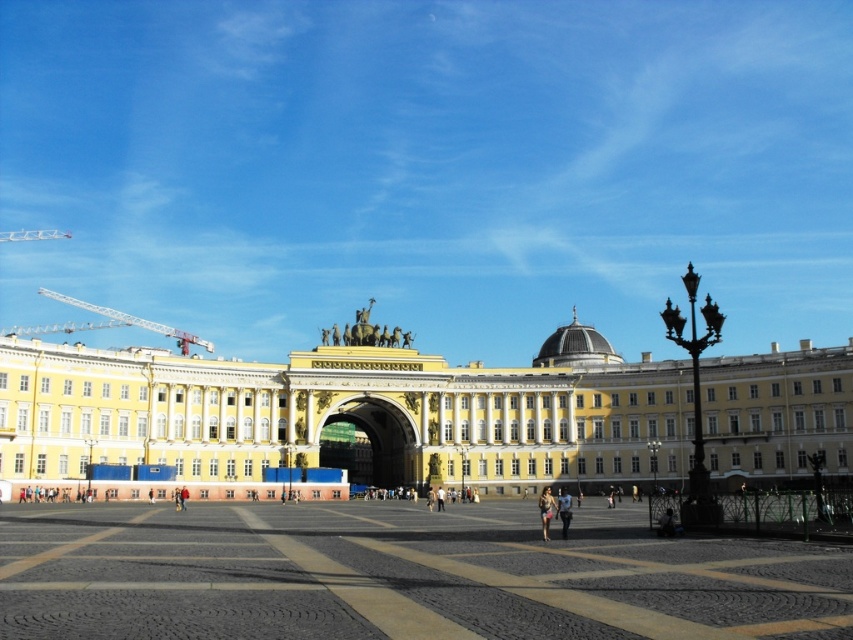
Question: Estimate the real-world distances between objects in this image. Which object is farther from the yellow/white stone building at center?

Choices:
 (A) denim shorts at lower center
 (B) metallic construction crane at left
 (C) smooth stone pavement at center
 (D) white metal crane at upper left

Answer: (D)

Question: Where is smooth stone pavement at center located in relation to metallic construction crane at left in the image?

Choices:
 (A) above
 (B) below

Answer: (B)

Question: Which is nearer to the yellow/white stone building at center?

Choices:
 (A) light brown leather jacket at center
 (B) denim shorts at lower center
 (C) smooth stone pavement at center
 (D) white metal crane at upper left

Answer: (B)

Question: Can you confirm if smooth stone pavement at center is thinner than light brown leather jacket at center?

Choices:
 (A) yes
 (B) no

Answer: (B)

Question: Which of the following is the farthest from the observer?

Choices:
 (A) (548, 534)
 (B) (485, 628)

Answer: (A)

Question: Considering the relative positions of metallic construction crane at left and light brown leather jacket at center in the image provided, where is metallic construction crane at left located with respect to light brown leather jacket at center?

Choices:
 (A) below
 (B) above

Answer: (B)